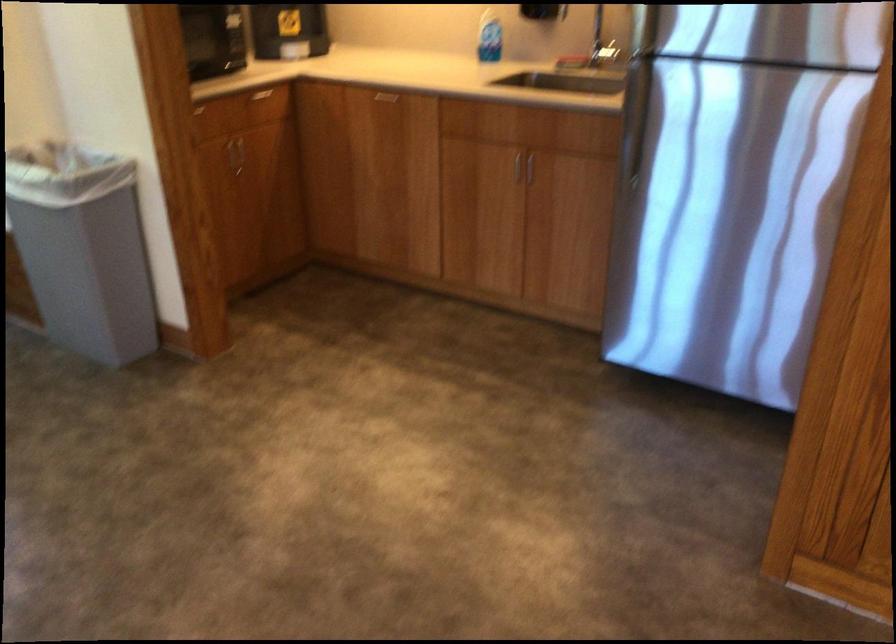
You are a GUI agent. You are given a task and a screenshot of the screen. Output one action in this format:
    pyautogui.click(x=<x>, y=<y>)
    Task: Click on the blue soap bottle
    The image size is (896, 644).
    Given the screenshot: What is the action you would take?
    pyautogui.click(x=488, y=37)